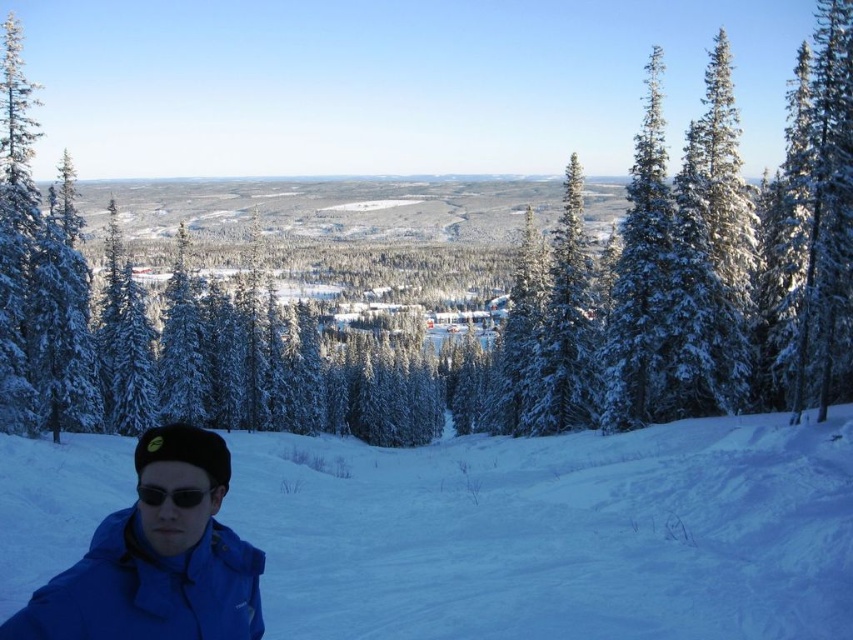
Consider the image. You are standing in the winter forest scene and want to walk from point (32, 545) to point (830, 12). Which point is closer to you when you start?

Point (32, 545) is closer to the viewer than point (830, 12), so the starting point is closer to you.